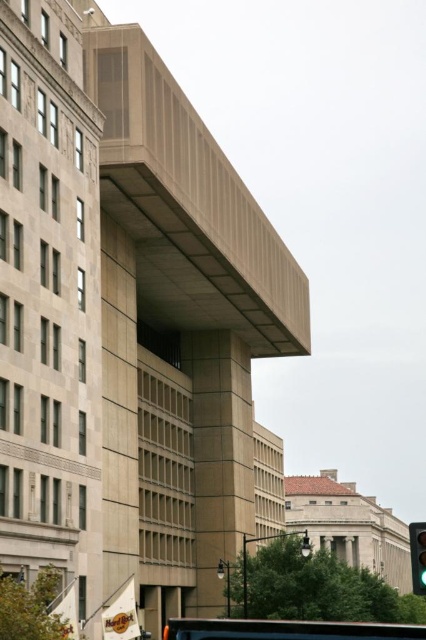
Question: Which point is closer to the camera taking this photo?

Choices:
 (A) (420, 540)
 (B) (275, 637)

Answer: (B)

Question: Does metallic silver bus at center have a larger size compared to green glass traffic light at lower right?

Choices:
 (A) no
 (B) yes

Answer: (B)

Question: Which of the following is the farthest from the observer?

Choices:
 (A) green glass traffic light at lower right
 (B) metallic silver bus at center

Answer: (A)

Question: Does metallic silver bus at center have a smaller size compared to green glass traffic light at lower right?

Choices:
 (A) yes
 (B) no

Answer: (B)

Question: In this image, where is metallic silver bus at center located relative to green glass traffic light at lower right?

Choices:
 (A) right
 (B) left

Answer: (B)